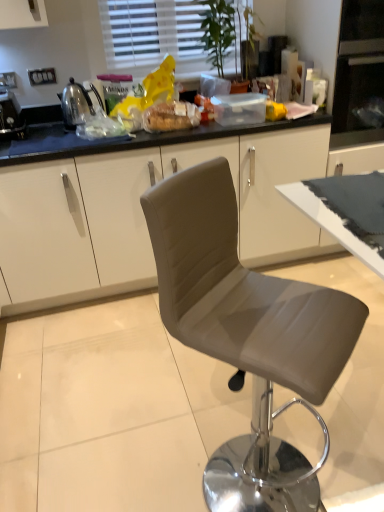
Locate an element on the screen. The height and width of the screenshot is (512, 384). vacant point above satin grey chair at center (from a real-world perspective) is located at coordinates (139, 381).